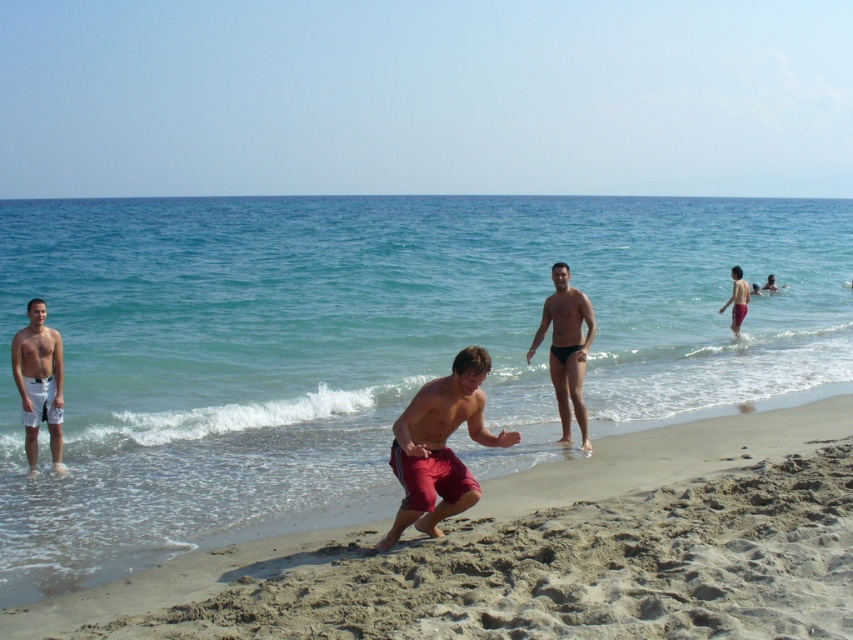
Is blue water at center above red fabric shorts at right?

Indeed, blue water at center is positioned over red fabric shorts at right.

Can you confirm if blue water at center is shorter than red fabric shorts at right?

Incorrect, blue water at center's height does not fall short of red fabric shorts at right's.

Identify the location of blue water at center. This screenshot has width=853, height=640. (366, 348).

Between smooth black swim trunks at center and white matte shorts at left, which one is positioned higher?

smooth black swim trunks at center

The width and height of the screenshot is (853, 640). I want to click on smooth black swim trunks at center, so click(x=566, y=348).

Can you confirm if red cotton shorts at center is bigger than red fabric shorts at right?

No, red cotton shorts at center is not bigger than red fabric shorts at right.

Does red cotton shorts at center appear under red fabric shorts at right?

Indeed, red cotton shorts at center is positioned under red fabric shorts at right.

What do you see at coordinates (440, 445) in the screenshot?
I see `red cotton shorts at center` at bounding box center [440, 445].

The height and width of the screenshot is (640, 853). I want to click on red cotton shorts at center, so click(x=440, y=445).